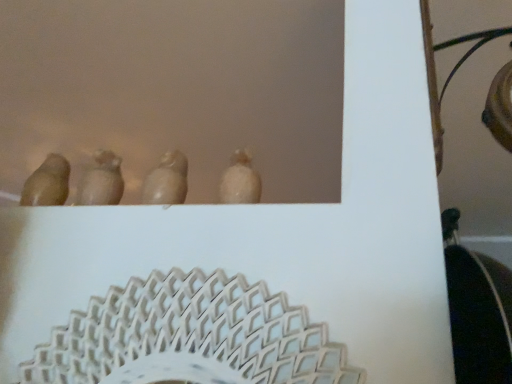
The image size is (512, 384). Identify the location of matte brown bird at center, which is the second animal from right to left. (101, 181).

Describe the element at coordinates (101, 181) in the screenshot. Image resolution: width=512 pixels, height=384 pixels. I see `matte brown bird at center, acting as the 1th animal starting from the left` at that location.

At what (x,y) coordinates should I click in order to perform the action: click on matte white bird at center, acting as the 1th animal starting from the right. Please return your answer as a coordinate pair (x, y). Looking at the image, I should click on (167, 180).

What do you see at coordinates (167, 180) in the screenshot?
I see `matte white bird at center, arranged as the second animal when viewed from the left` at bounding box center [167, 180].

Where is `matte brown bird at center, which is the second animal from right to left`? The width and height of the screenshot is (512, 384). matte brown bird at center, which is the second animal from right to left is located at coordinates (101, 181).

Between matte white bird at center, arranged as the second animal when viewed from the left, and matte brown bird at center, acting as the 1th animal starting from the left, which one appears on the left side from the viewer's perspective?

matte brown bird at center, acting as the 1th animal starting from the left.

Does matte white bird at center, arranged as the second animal when viewed from the left, lie in front of matte brown bird at center, which is the second animal from right to left?

Yes, it is.

Does point (143, 184) come closer to viewer compared to point (105, 160)?

Yes.

From the image's perspective, which one is positioned higher, matte white bird at center, arranged as the second animal when viewed from the left, or matte brown bird at center, acting as the 1th animal starting from the left?

matte white bird at center, arranged as the second animal when viewed from the left, appears higher in the image.

From a real-world perspective, is matte white bird at center, arranged as the second animal when viewed from the left, positioned above or below matte brown bird at center, which is the second animal from right to left?

From a real-world perspective, matte white bird at center, arranged as the second animal when viewed from the left, is physically above matte brown bird at center, which is the second animal from right to left.

Consider the image. Does matte white bird at center, acting as the 1th animal starting from the right, have a lesser width compared to matte brown bird at center, which is the second animal from right to left?

Yes, matte white bird at center, acting as the 1th animal starting from the right, is thinner than matte brown bird at center, which is the second animal from right to left.

Considering the relative sizes of matte white bird at center, arranged as the second animal when viewed from the left, and matte brown bird at center, which is the second animal from right to left, in the image provided, is matte white bird at center, arranged as the second animal when viewed from the left, taller than matte brown bird at center, which is the second animal from right to left,?

Indeed, matte white bird at center, arranged as the second animal when viewed from the left, has a greater height compared to matte brown bird at center, which is the second animal from right to left.

From the picture: Is matte white bird at center, arranged as the second animal when viewed from the left, smaller than matte brown bird at center, which is the second animal from right to left?

Yes, matte white bird at center, arranged as the second animal when viewed from the left, is smaller than matte brown bird at center, which is the second animal from right to left.

Is matte white bird at center, arranged as the second animal when viewed from the left, inside or outside of matte brown bird at center, which is the second animal from right to left?

matte white bird at center, arranged as the second animal when viewed from the left, is outside matte brown bird at center, which is the second animal from right to left.

Is matte white bird at center, arranged as the second animal when viewed from the left, beside matte brown bird at center, acting as the 1th animal starting from the left?

They are not placed beside each other.

Is matte white bird at center, acting as the 1th animal starting from the right, turned away from matte brown bird at center, acting as the 1th animal starting from the left?

That's not correct — matte white bird at center, acting as the 1th animal starting from the right, is not looking away from matte brown bird at center, acting as the 1th animal starting from the left.

What's the angular difference between matte white bird at center, acting as the 1th animal starting from the right, and matte brown bird at center, which is the second animal from right to left,'s facing directions?

1.47 degrees separate the facing orientations of matte white bird at center, acting as the 1th animal starting from the right, and matte brown bird at center, which is the second animal from right to left.

Where is `animal lying on the right of matte brown bird at center, acting as the 1th animal starting from the left`? animal lying on the right of matte brown bird at center, acting as the 1th animal starting from the left is located at coordinates (167, 180).

Is matte brown bird at center, which is the second animal from right to left, to the right of matte white bird at center, arranged as the second animal when viewed from the left, from the viewer's perspective?

No.

Is matte brown bird at center, acting as the 1th animal starting from the left, closer to the viewer compared to matte white bird at center, acting as the 1th animal starting from the right?

No.

Which is behind, point (94, 160) or point (164, 183)?

The point (94, 160) is more distant.

From the image's perspective, between matte brown bird at center, acting as the 1th animal starting from the left, and matte white bird at center, acting as the 1th animal starting from the right, who is located below?

From the image's view, matte brown bird at center, acting as the 1th animal starting from the left, is below.

From a real-world perspective, is matte brown bird at center, acting as the 1th animal starting from the left, located higher than matte white bird at center, acting as the 1th animal starting from the right?

No, from a real-world perspective, matte brown bird at center, acting as the 1th animal starting from the left, is not above matte white bird at center, acting as the 1th animal starting from the right.

Can you confirm if matte brown bird at center, which is the second animal from right to left, is wider than matte white bird at center, acting as the 1th animal starting from the right?

Correct, the width of matte brown bird at center, which is the second animal from right to left, exceeds that of matte white bird at center, acting as the 1th animal starting from the right.

Considering the relative sizes of matte brown bird at center, which is the second animal from right to left, and matte white bird at center, acting as the 1th animal starting from the right, in the image provided, is matte brown bird at center, which is the second animal from right to left, shorter than matte white bird at center, acting as the 1th animal starting from the right,?

Yes.

In terms of size, does matte brown bird at center, acting as the 1th animal starting from the left, appear bigger or smaller than matte white bird at center, arranged as the second animal when viewed from the left?

matte brown bird at center, acting as the 1th animal starting from the left, is bigger than matte white bird at center, arranged as the second animal when viewed from the left.

Is matte white bird at center, arranged as the second animal when viewed from the left, located within matte brown bird at center, acting as the 1th animal starting from the left?

Actually, matte white bird at center, arranged as the second animal when viewed from the left, is outside matte brown bird at center, acting as the 1th animal starting from the left.

Consider the image. Is matte brown bird at center, which is the second animal from right to left, touching matte white bird at center, acting as the 1th animal starting from the right?

matte brown bird at center, which is the second animal from right to left, is not next to matte white bird at center, acting as the 1th animal starting from the right, and they're not touching.

Is matte brown bird at center, acting as the 1th animal starting from the left, positioned with its back to matte white bird at center, arranged as the second animal when viewed from the left?

matte brown bird at center, acting as the 1th animal starting from the left, is not turned away from matte white bird at center, arranged as the second animal when viewed from the left.

How far apart are matte brown bird at center, which is the second animal from right to left, and matte white bird at center, acting as the 1th animal starting from the right?

matte brown bird at center, which is the second animal from right to left, and matte white bird at center, acting as the 1th animal starting from the right, are 4.72 inches apart.

There is a matte brown bird at center, which is the second animal from right to left. At what (x,y) coordinates should I click in order to perform the action: click on animal above it (from a real-world perspective). Please return your answer as a coordinate pair (x, y). The height and width of the screenshot is (384, 512). Looking at the image, I should click on (167, 180).

What are the coordinates of `animal that is below the matte white bird at center, acting as the 1th animal starting from the right (from the image's perspective)` in the screenshot? It's located at (101, 181).

At what (x,y) coordinates should I click in order to perform the action: click on animal on the right of matte brown bird at center, which is the second animal from right to left. Please return your answer as a coordinate pair (x, y). Looking at the image, I should click on (167, 180).